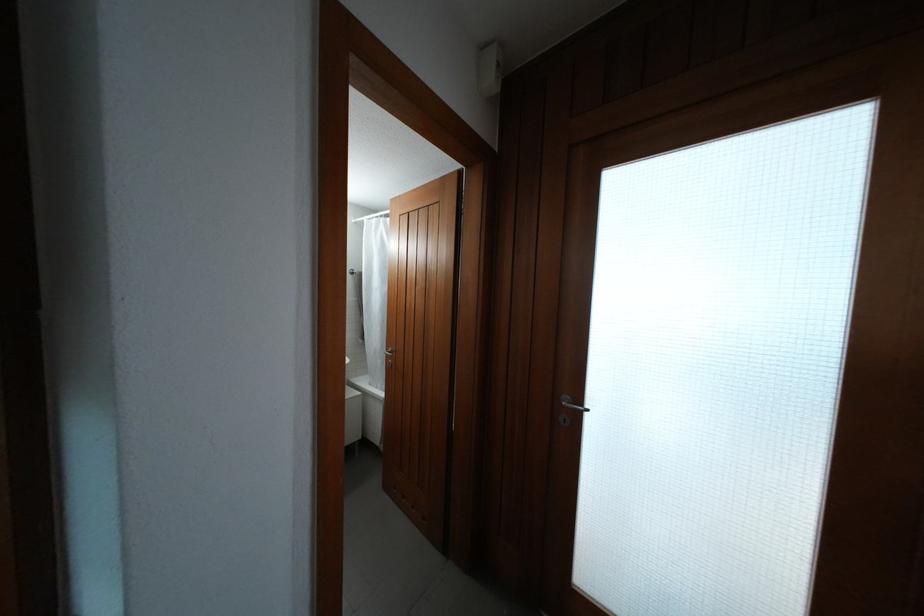
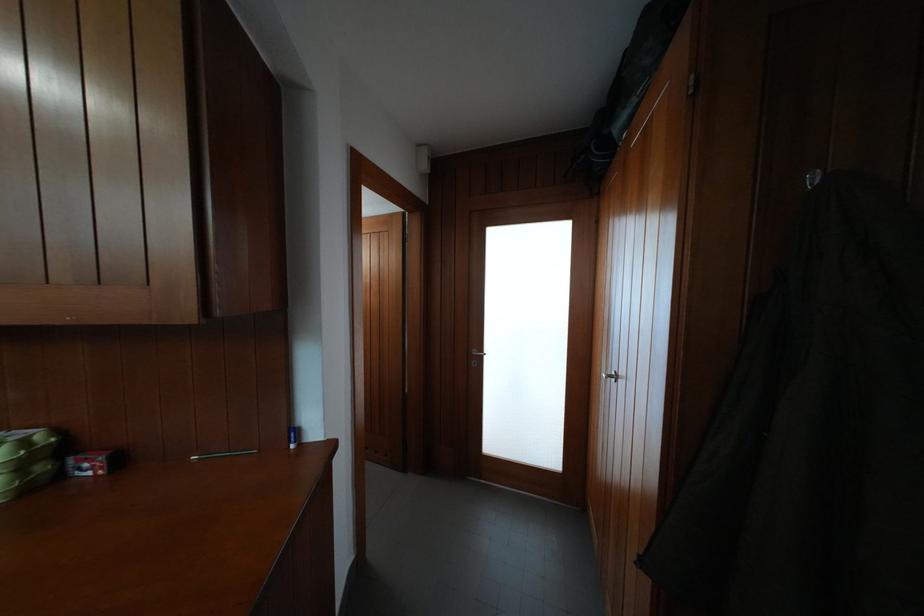
Which direction would the cameraman need to move to produce the second image?

The cameraman moved toward left, backward.